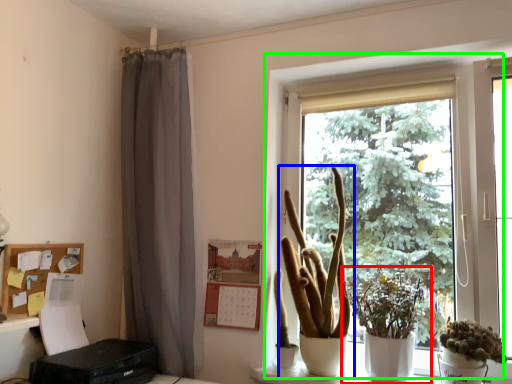
Question: Which object is positioned closest to houseplant (highlighted by a red box)? Select from houseplant (highlighted by a blue box) and window (highlighted by a green box).

Choices:
 (A) houseplant
 (B) window

Answer: (A)